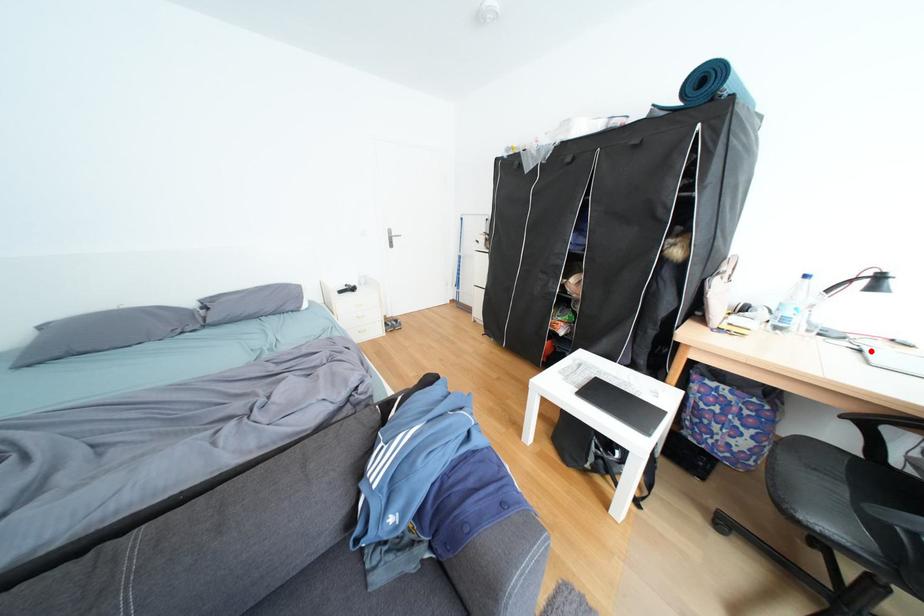
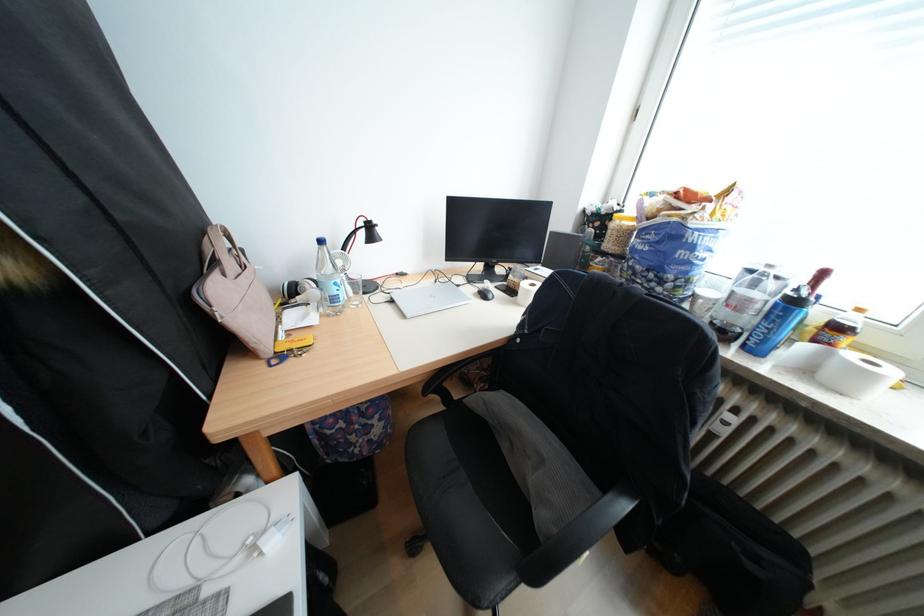
In the second image, find the point that corresponds to the highlighted location in the first image.

(405, 302)